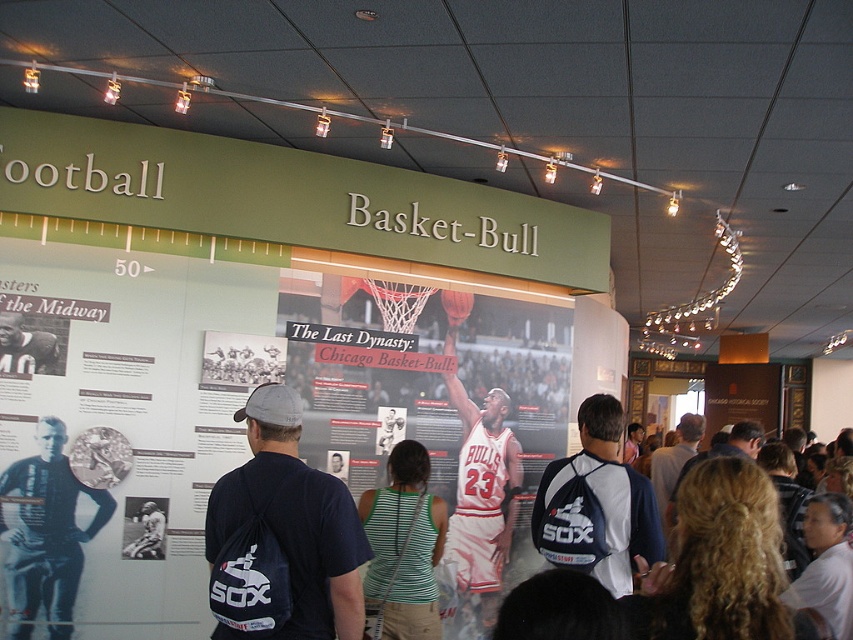
Question: Is matte basketball jersey at center in front of white shirt at center?

Choices:
 (A) yes
 (B) no

Answer: (B)

Question: Which point is farther to the camera?

Choices:
 (A) (364, 595)
 (B) (161, 529)
 (C) (473, 305)
 (D) (485, 467)

Answer: (C)

Question: Does blue fabric backpack at center have a lesser width compared to white shirt at center?

Choices:
 (A) no
 (B) yes

Answer: (B)

Question: Does green striped tank top at center appear on the left side of matte black baseball cap at upper center?

Choices:
 (A) yes
 (B) no

Answer: (B)

Question: Which object is the farthest from the white jersey basketball at center?

Choices:
 (A) blue fabric backpack at center
 (B) dark blue t-shirt at center

Answer: (B)

Question: Estimate the real-world distances between objects in this image. Which object is closer to the black leather jacket at left?

Choices:
 (A) white jersey basketball at center
 (B) matte basketball jersey at center
 (C) blue fabric backpack at center

Answer: (B)